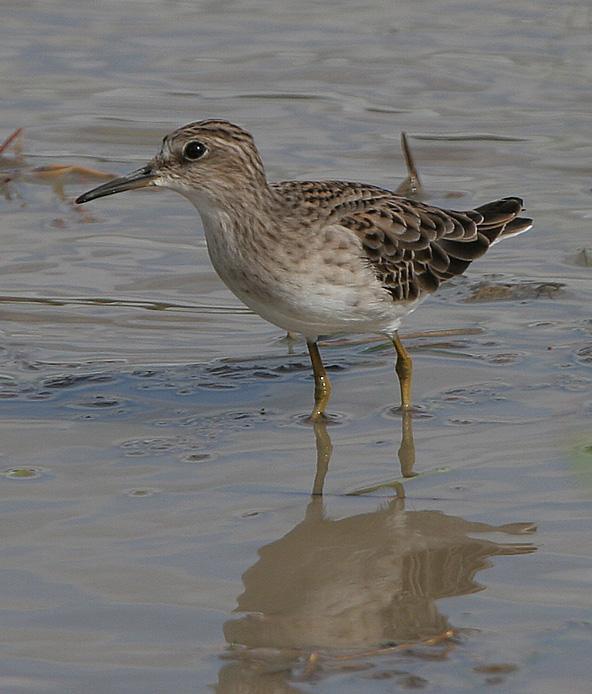
Locate an element on the screen. Image resolution: width=592 pixels, height=694 pixels. chest is located at coordinates (243, 273).